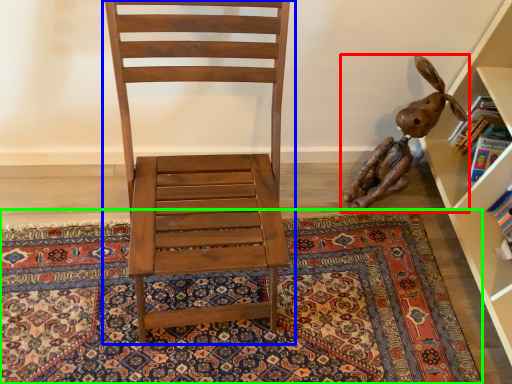
Question: Based on their relative distances, which object is farther from toy (highlighted by a red box)? Choose from chair (highlighted by a blue box) and mat (highlighted by a green box).

Choices:
 (A) chair
 (B) mat

Answer: (A)